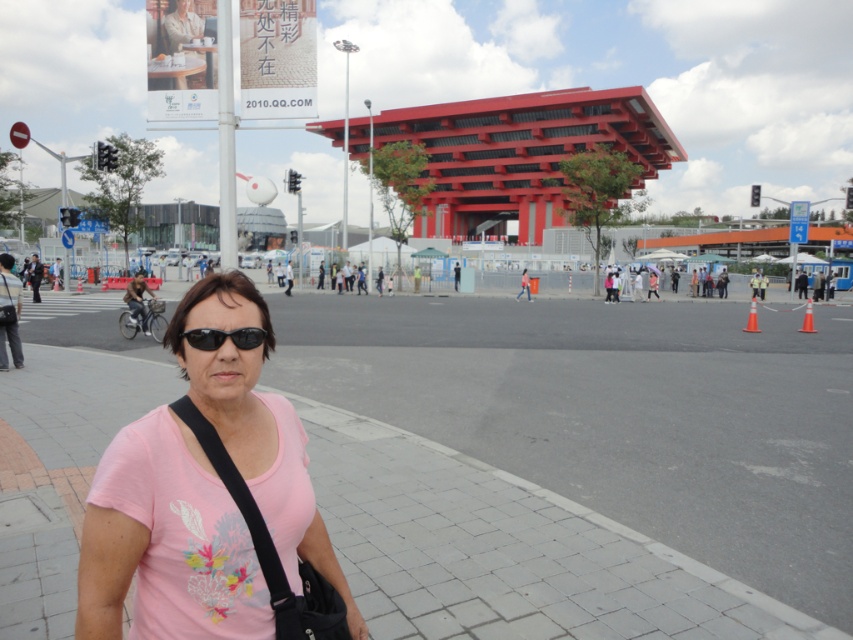
You are a photographer trying to capture a candid shot of the woman in the pink fabric shirt at center and the black matte sunglasses at center. To ensure both are in focus, you need to know their vertical alignment. Which object is positioned lower in the image?

The pink fabric shirt at center is located below the black matte sunglasses at center, so the shirt is lower in the image.

You are standing at the point marked by coordinates point [576,465]. Looking around, you see the woman in the pink floral T shirt and dark sunglasses. Which direction should you walk to reach her?

The point [576,465] is located at the gray concrete pavement at lower left. The woman in the pink floral T shirt and dark sunglasses is in the foreground. Since the point is at the lower left, you should walk towards the upper right direction to reach her.

You are a photographer at the plaza and want to capture both the pink fabric shirt at center and the black matte sunglasses at center in a single frame. Given their sizes, which object should you focus on to ensure both are clearly visible in your photo?

The pink fabric shirt at center is bigger than the black matte sunglasses at center, so focusing on the pink fabric shirt at center will ensure both are clearly visible as it takes up more space in the frame.